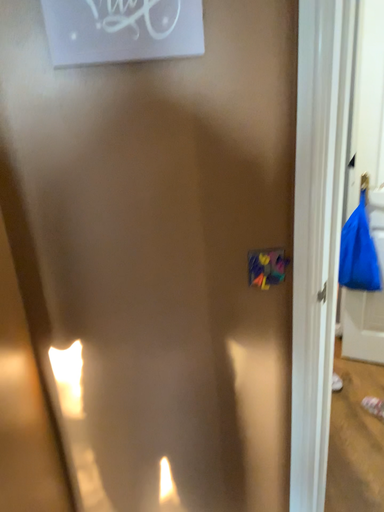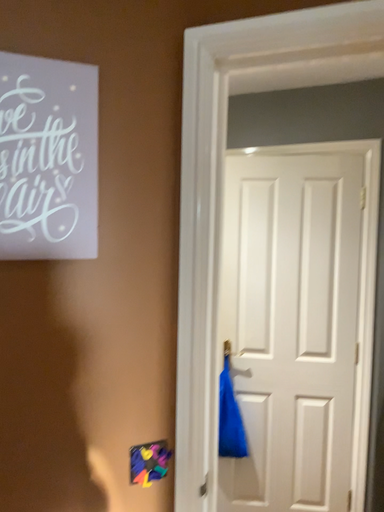
Question: How did the camera likely rotate when shooting the video?

Choices:
 (A) rotated downward
 (B) rotated upward

Answer: (B)